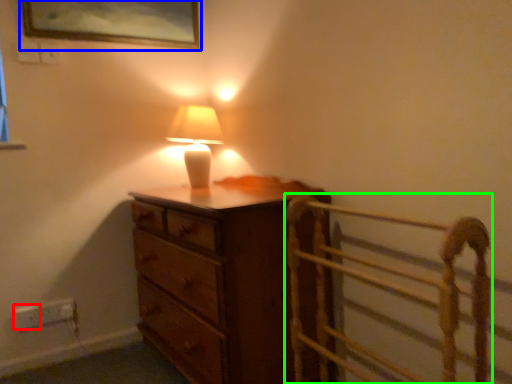
Question: Estimate the real-world distances between objects in this image. Which object is farther from electric outlet (highlighted by a red box), picture frame (highlighted by a blue box) or bed frame (highlighted by a green box)?

Choices:
 (A) picture frame
 (B) bed frame

Answer: (B)